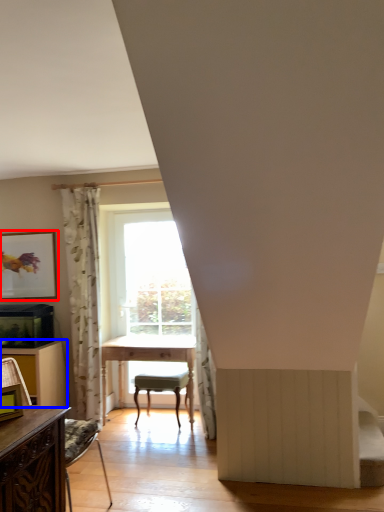
Question: Which of the following is the farthest to the observer, picture frame (highlighted by a red box) or dresser (highlighted by a blue box)?

Choices:
 (A) picture frame
 (B) dresser

Answer: (A)